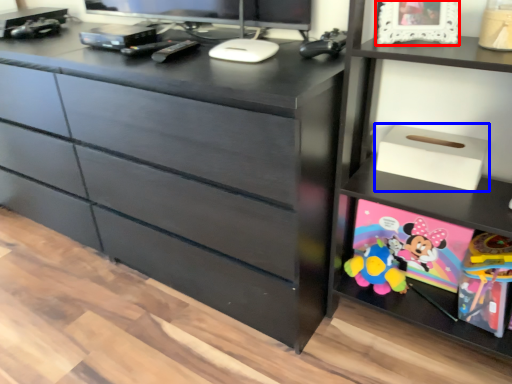
Question: Which point is further to the camera, picture frame (highlighted by a red box) or storage box (highlighted by a blue box)?

Choices:
 (A) picture frame
 (B) storage box

Answer: (B)